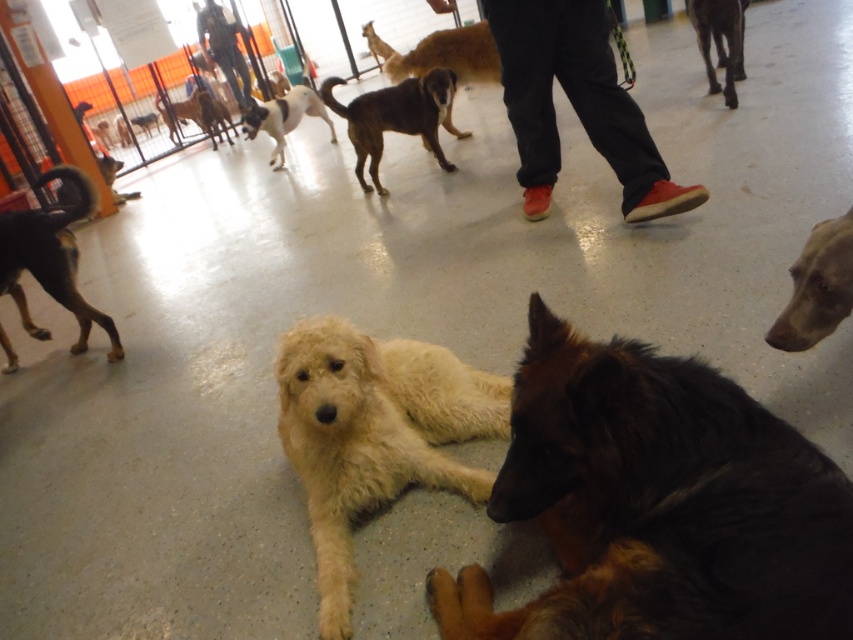
Question: Is brown shaggy dog at center above smooth tan dog at lower right?

Choices:
 (A) no
 (B) yes

Answer: (B)

Question: Estimate the real-world distances between objects in this image. Which object is closer to the brown fur dog at left?

Choices:
 (A) brown shaggy dog at lower right
 (B) white fluffy dog at upper center

Answer: (A)

Question: Estimate the real-world distances between objects in this image. Which object is farther from the red canvas shoes at center?

Choices:
 (A) white fur dog at upper center
 (B) light beige fur at center

Answer: (A)

Question: Is brown fur dog at upper right below white fur dog at upper center?

Choices:
 (A) no
 (B) yes

Answer: (B)

Question: In this image, where is dark blue jeans at upper center located relative to white fluffy dog at upper center?

Choices:
 (A) right
 (B) left

Answer: (A)

Question: Considering the real-world distances, which object is farthest from the brown shaggy dog at lower right?

Choices:
 (A) brown fur dog at upper right
 (B) white fur dog at upper center

Answer: (B)